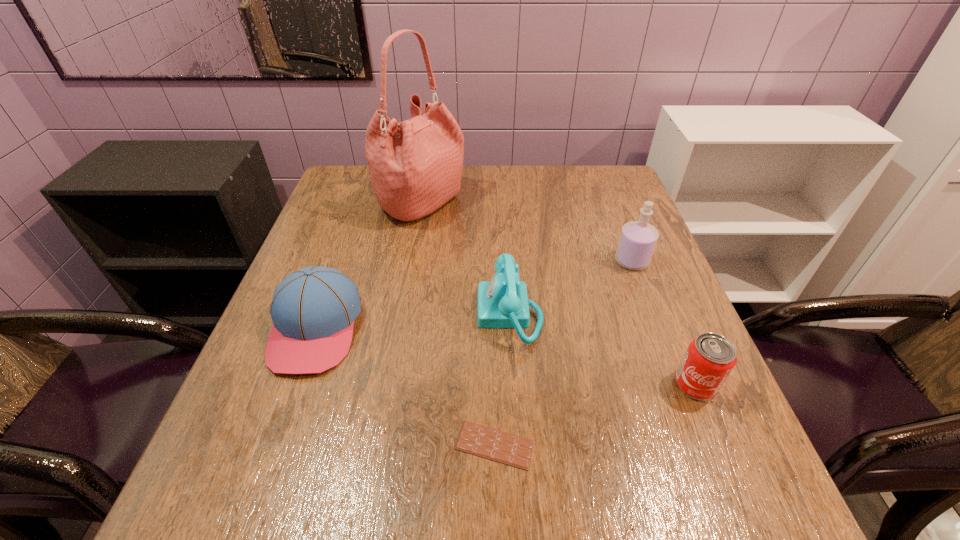
Find the location of a particular element. The height and width of the screenshot is (540, 960). free location located 0.170m on the front of the second farthest object is located at coordinates (657, 327).

At what (x,y) coordinates should I click in order to perform the action: click on free space located 0.180m on the front-facing side of the baseball cap. Please return your answer as a coordinate pair (x, y). Looking at the image, I should click on (264, 475).

Locate an element on the screen. vacant region located 0.190m on the dial of the telephone is located at coordinates (389, 314).

Locate an element on the screen. Image resolution: width=960 pixels, height=540 pixels. vacant space located 0.150m on the dial of the telephone is located at coordinates (408, 314).

Identify the location of free region located 0.350m on the dial of the telephone. (315, 314).

The height and width of the screenshot is (540, 960). What are the coordinates of `blank space located on the front of the can` in the screenshot? It's located at (750, 516).

Locate an element on the screen. Image resolution: width=960 pixels, height=540 pixels. free space located 0.170m on the left of the shortest object is located at coordinates (352, 445).

At what (x,y) coordinates should I click in order to perform the action: click on object that is at the far edge. Please return your answer as a coordinate pair (x, y). The height and width of the screenshot is (540, 960). Looking at the image, I should click on (415, 166).

Where is `object that is at the near edge`? object that is at the near edge is located at coordinates (492, 444).

You are a GUI agent. You are given a task and a screenshot of the screen. Output one action in this format:
    pyautogui.click(x=<x>, y=<y>)
    Task: Click on the handbag located at the left edge
    The width and height of the screenshot is (960, 540).
    Given the screenshot: What is the action you would take?
    pyautogui.click(x=415, y=166)